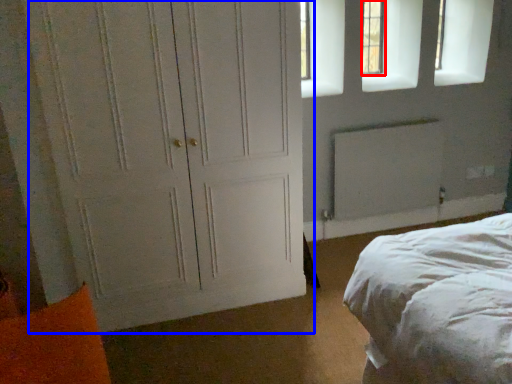
Question: Among these objects, which one is nearest to the camera, window (highlighted by a red box) or door (highlighted by a blue box)?

Choices:
 (A) window
 (B) door

Answer: (B)